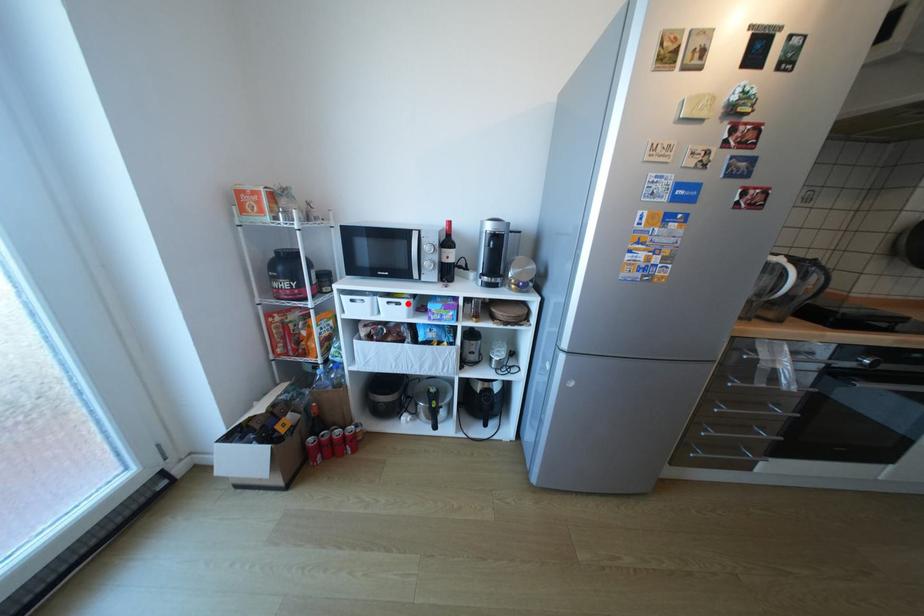
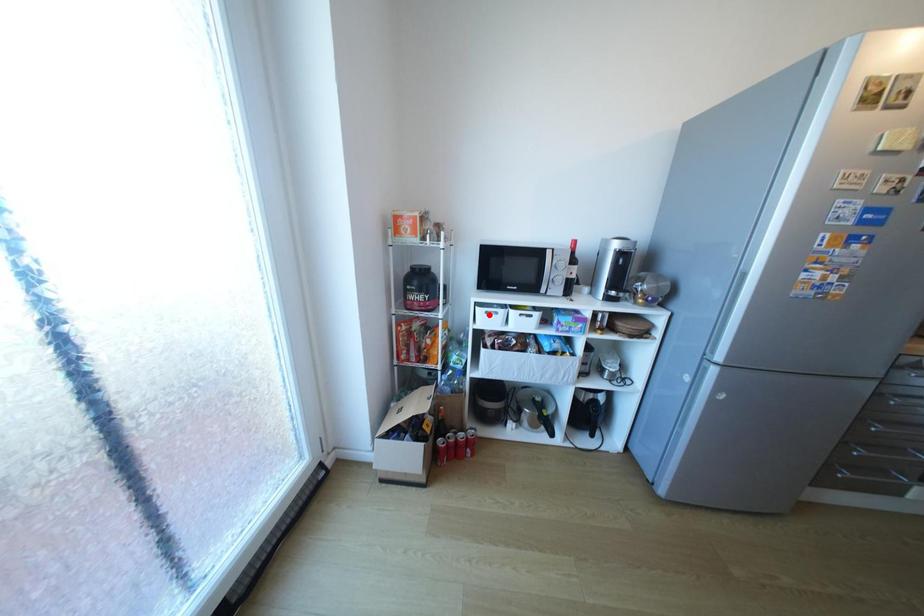
I am providing you with two images of the same scene from different viewpoints. A red point is marked on the first image and another point is marked on the second image. Do the highlighted points in image1 and image2 indicate the same real-world spot?

No